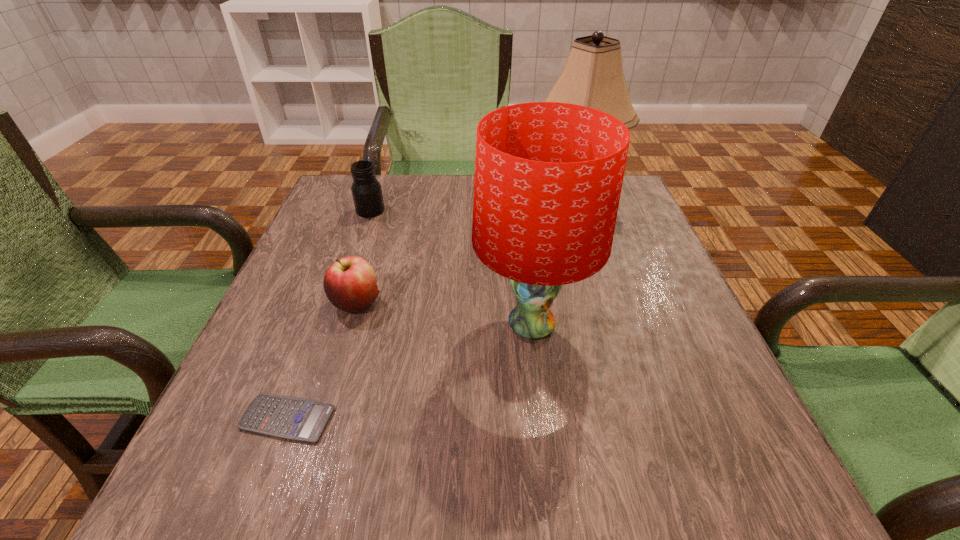
Where is `vacant area that lies between the third tallest object and the lamp`? Image resolution: width=960 pixels, height=540 pixels. vacant area that lies between the third tallest object and the lamp is located at coordinates (471, 207).

This screenshot has height=540, width=960. What are the coordinates of `free point between the nearest object and the apple` in the screenshot? It's located at (323, 361).

Locate an element on the screen. This screenshot has width=960, height=540. vacant area that lies between the third tallest object and the lampshade is located at coordinates (451, 268).

What are the coordinates of `free area in between the apple and the shortest object` in the screenshot? It's located at (323, 361).

What are the coordinates of `free space between the apple and the lampshade` in the screenshot? It's located at (444, 314).

Where is `free space between the lampshade and the shortest object`? This screenshot has width=960, height=540. free space between the lampshade and the shortest object is located at coordinates (410, 372).

The image size is (960, 540). I want to click on object that stands as the second closest to the jar, so pos(548,176).

I want to click on the closest object relative to the lamp, so click(548, 176).

You are a GUI agent. You are given a task and a screenshot of the screen. Output one action in this format:
    pyautogui.click(x=<x>, y=<y>)
    Task: Click on the free space in the image that satisfies the following two spatial constraints: 1. on the back side of the nearest object; 2. on the right side of the apple
    The image size is (960, 540).
    Given the screenshot: What is the action you would take?
    pyautogui.click(x=330, y=303)

Where is `free space that satisfies the following two spatial constraints: 1. on the back side of the lamp; 2. on the left side of the apple`? The height and width of the screenshot is (540, 960). free space that satisfies the following two spatial constraints: 1. on the back side of the lamp; 2. on the left side of the apple is located at coordinates (387, 204).